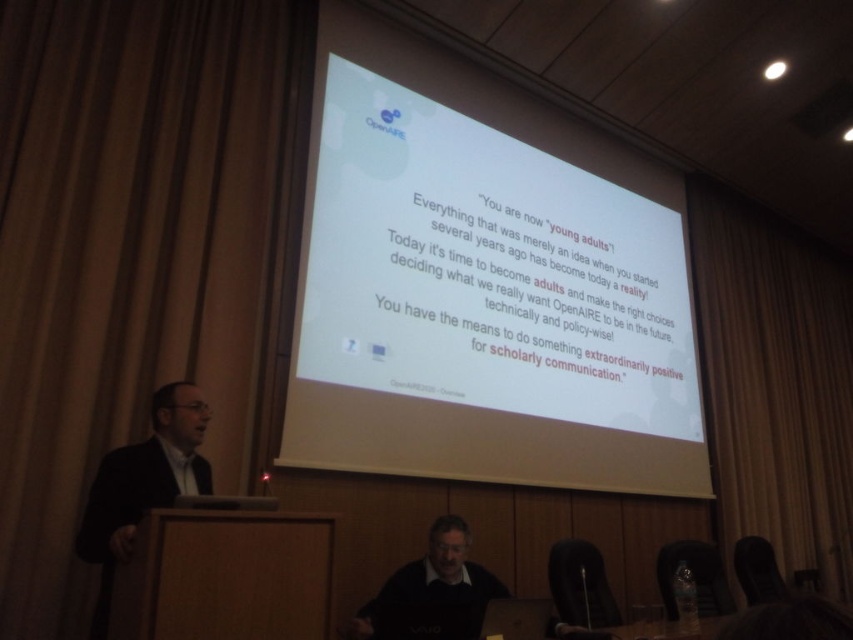
Question: Based on their relative distances, which object is farther from the black suit at left?

Choices:
 (A) brown fabric curtain at left
 (B) dark gray sweater at lower center

Answer: (A)

Question: Which is farther from the wooden table at lower left?

Choices:
 (A) white matte projector screen at upper center
 (B) brown fabric curtain at upper left
 (C) black suit at left
 (D) brown fabric curtain at left

Answer: (B)

Question: Does wooden table at lower left have a lesser width compared to black suit at left?

Choices:
 (A) yes
 (B) no

Answer: (B)

Question: Does white matte projector screen at upper center appear under dark gray sweater at lower center?

Choices:
 (A) no
 (B) yes

Answer: (A)

Question: Does brown fabric curtain at upper left appear over black suit at left?

Choices:
 (A) yes
 (B) no

Answer: (B)

Question: Estimate the real-world distances between objects in this image. Which object is farther from the wooden table at lower left?

Choices:
 (A) brown fabric curtain at left
 (B) black suit at left
 (C) dark gray sweater at lower center

Answer: (A)